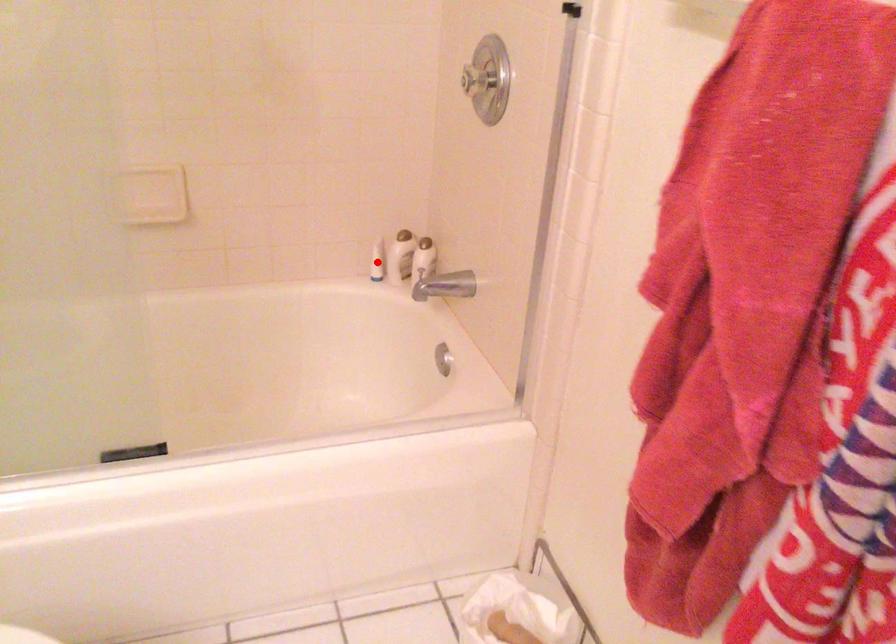
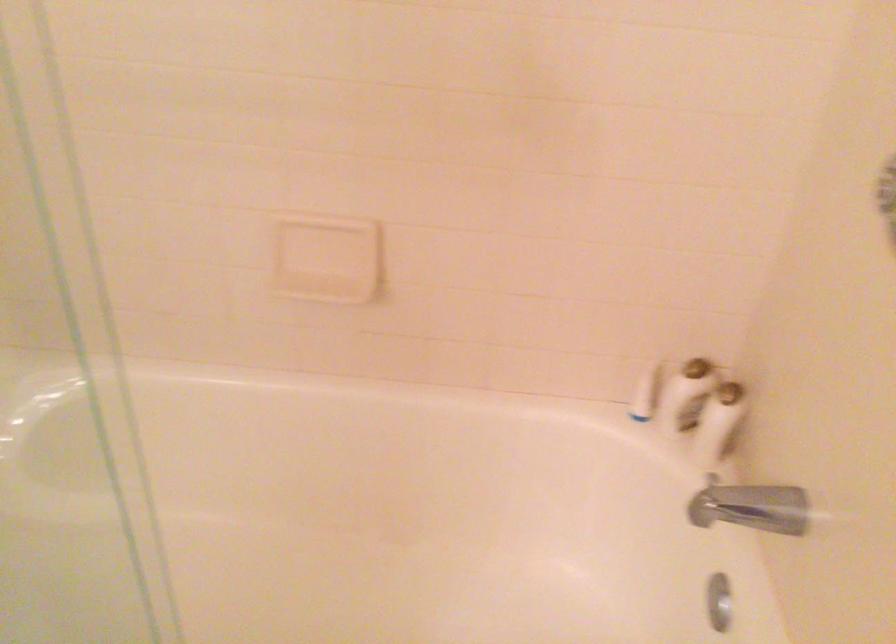
Find the pixel in the second image that matches the highlighted location in the first image.

(644, 393)